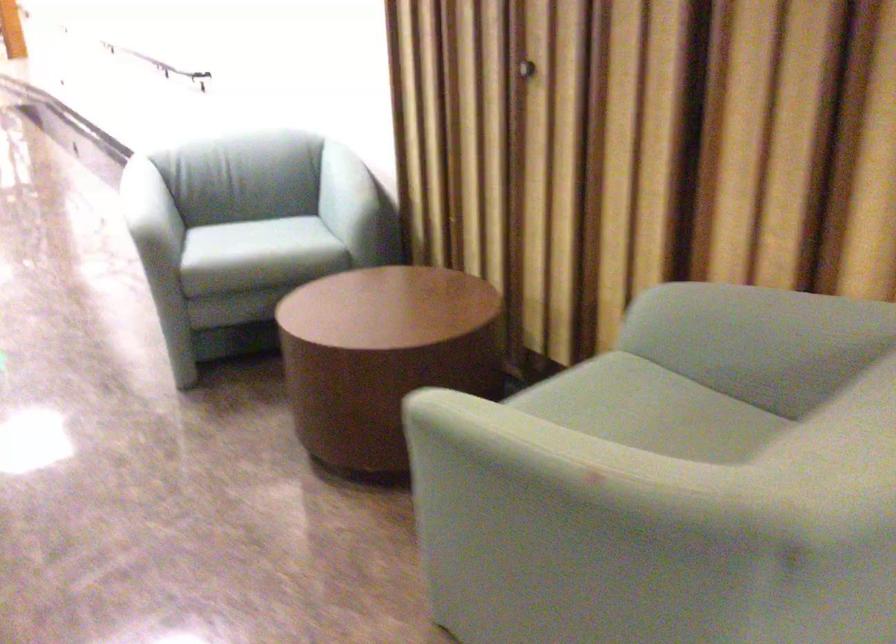
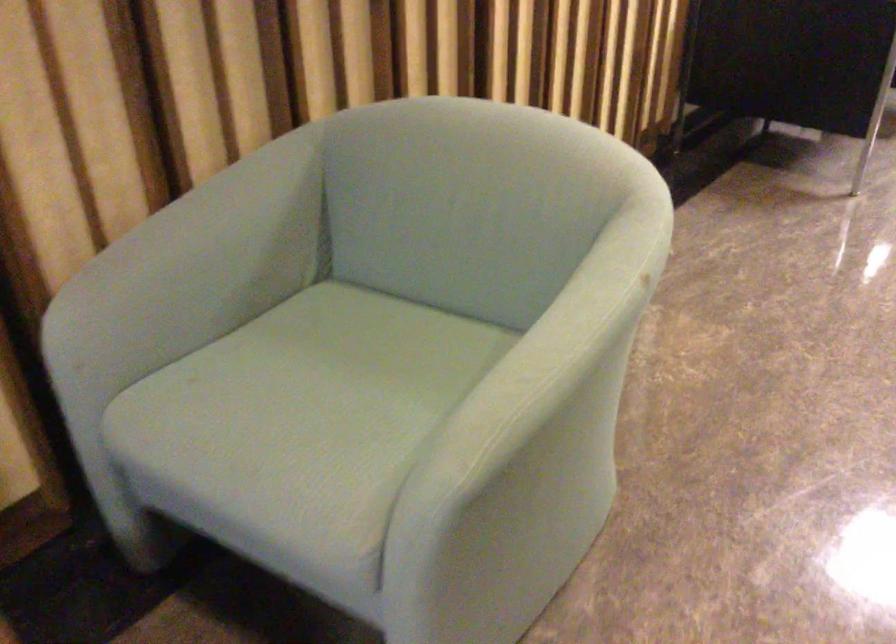
The point at [478,408] is marked in the first image. Where is the corresponding point in the second image?

(533, 375)